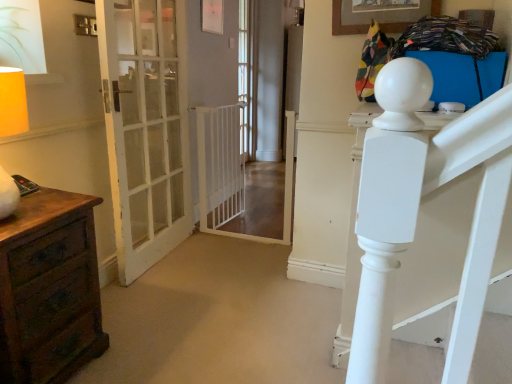
Question: In terms of height, does brown wood chest of drawers at left look taller or shorter compared to white plastic gate at center?

Choices:
 (A) short
 (B) tall

Answer: (A)

Question: Is brown wood chest of drawers at left wider or thinner than white plastic gate at center?

Choices:
 (A) wide
 (B) thin

Answer: (A)

Question: Estimate the real-world distances between objects in this image. Which object is farther from the clear glass door at center?

Choices:
 (A) white glass door at left
 (B) white plastic gate at center
 (C) brown wood chest of drawers at left
 (D) wooden picture frame at upper center

Answer: (C)

Question: Which object is positioned farthest from the wooden picture frame at upper center?

Choices:
 (A) white plastic gate at center
 (B) clear glass door at center
 (C) white glass door at left
 (D) brown wood chest of drawers at left

Answer: (B)